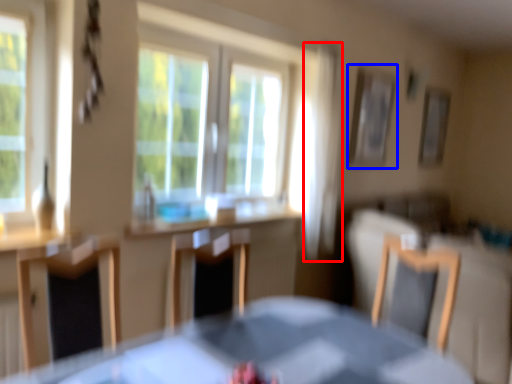
Question: Which object is closer to the camera taking this photo, curtain (highlighted by a red box) or picture frame (highlighted by a blue box)?

Choices:
 (A) curtain
 (B) picture frame

Answer: (A)